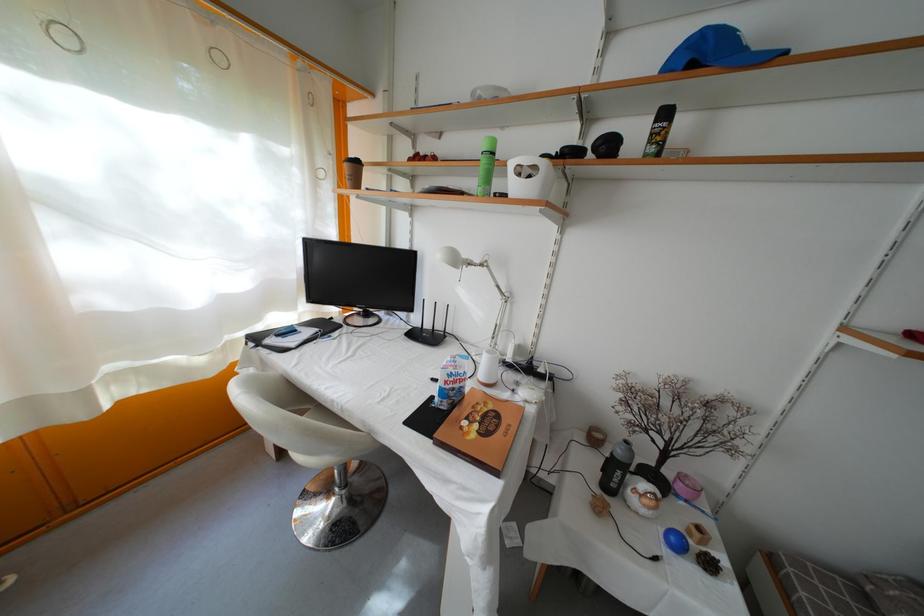
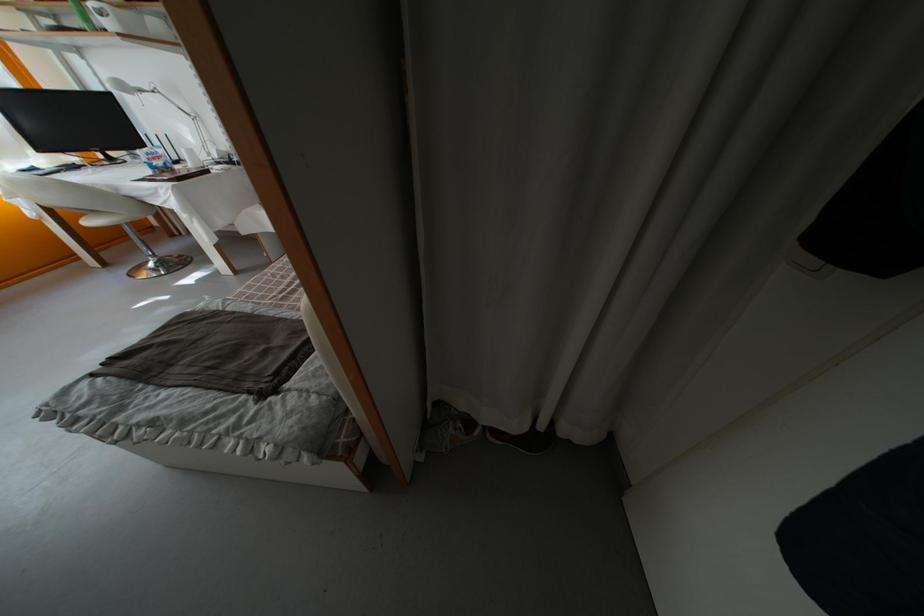
Where in the second image is the point corresponding to (x=469, y=262) from the first image?

(139, 91)